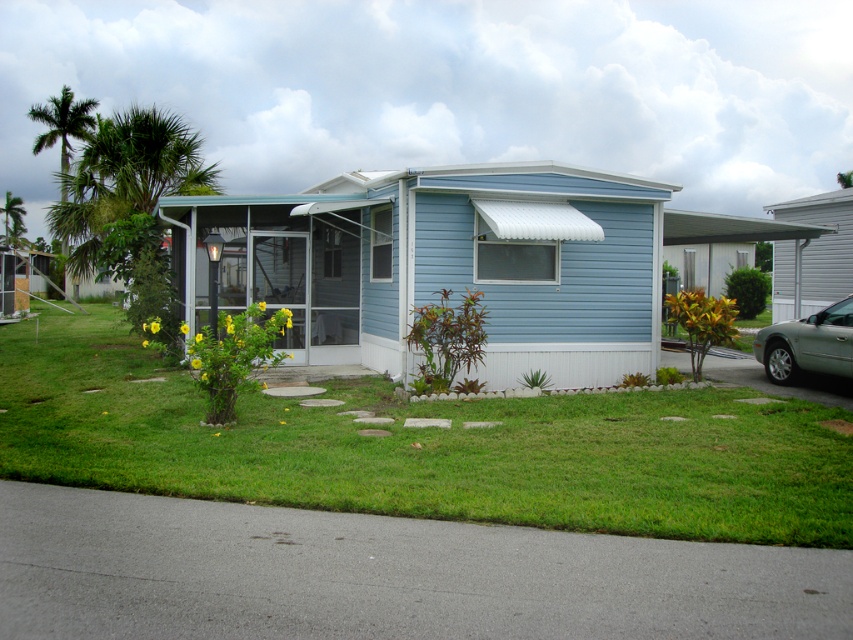
Question: Can you confirm if satin silver car at right is positioned to the left of green leafy palm tree at upper left?

Choices:
 (A) no
 (B) yes

Answer: (A)

Question: Is satin silver car at right closer to camera compared to green leafy palm tree at upper left?

Choices:
 (A) no
 (B) yes

Answer: (B)

Question: Does green grass lawn at center appear on the left side of green leafy palm tree at upper left?

Choices:
 (A) yes
 (B) no

Answer: (B)

Question: Which of these objects is positioned farthest from the satin silver car at right?

Choices:
 (A) green leafy palm tree at upper left
 (B) green grass lawn at center

Answer: (A)

Question: Which of these objects is positioned farthest from the green grass lawn at center?

Choices:
 (A) satin silver car at right
 (B) green leafy palm tree at upper left

Answer: (B)

Question: Which point is closer to the camera?

Choices:
 (A) green leafy palm tree at upper left
 (B) satin silver car at right

Answer: (B)